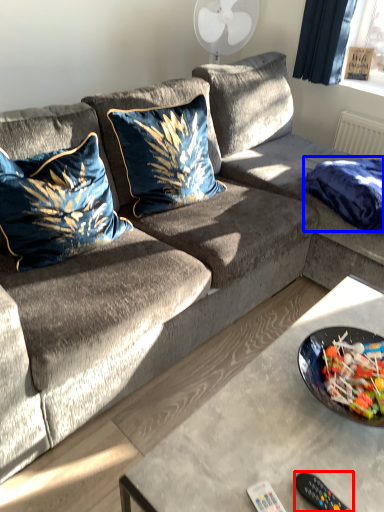
Question: Which point is further to the camera, remote control (highlighted by a red box) or blanket (highlighted by a blue box)?

Choices:
 (A) remote control
 (B) blanket

Answer: (B)